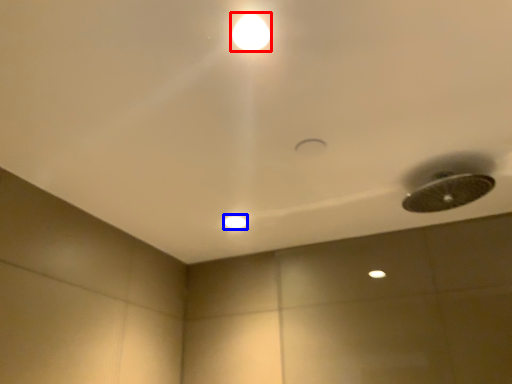
Question: Which of the following is the farthest to the observer, lamp (highlighted by a red box) or dot (highlighted by a blue box)?

Choices:
 (A) lamp
 (B) dot

Answer: (B)